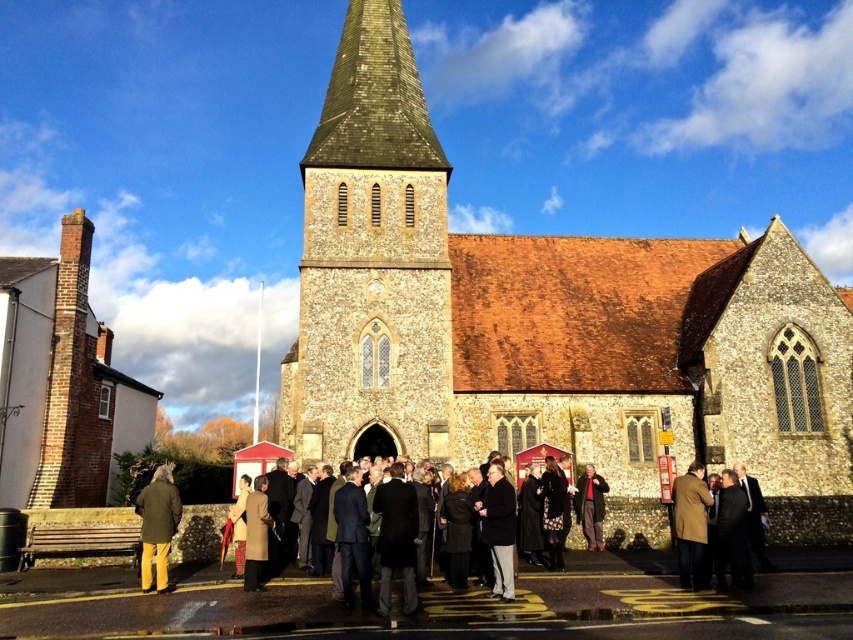
You are a photographer positioned in front of the traditional stone church. You want to take a photo that includes both the brown wool coat at center and the dark gray suit at center. Which object should you focus on first to ensure both are in frame?

The brown wool coat at center is much taller than the dark gray suit at center, so you should focus on the brown wool coat at center first to ensure both are in frame.

You are standing in front of the brown stone tower at center, and you want to take a photo that includes the entire tower in the frame. Considering your camera has a maximum zoom range of 50 meters, will you be able to capture the entire tower without moving closer?

The brown stone tower at center is 50.69 meters from the camera, which exceeds the camera maximum zoom range of 50 meters. Therefore, you cannot capture the entire tower without moving closer.

You are standing at the point marked by coordinates point (x=691, y=524). What object are you currently standing on?

You are standing on the brown wool coat at center.